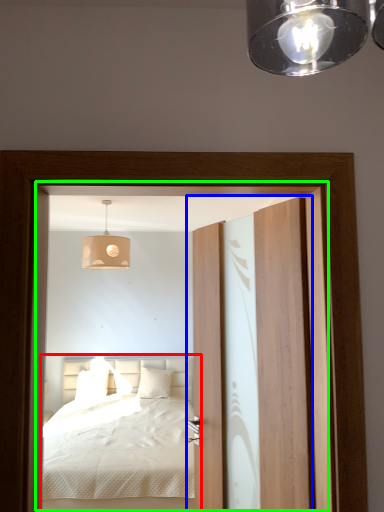
Question: Considering the real-world distances, which object is closest to bed (highlighted by a red box)? door (highlighted by a blue box) or screen door (highlighted by a green box).

Choices:
 (A) door
 (B) screen door

Answer: (B)